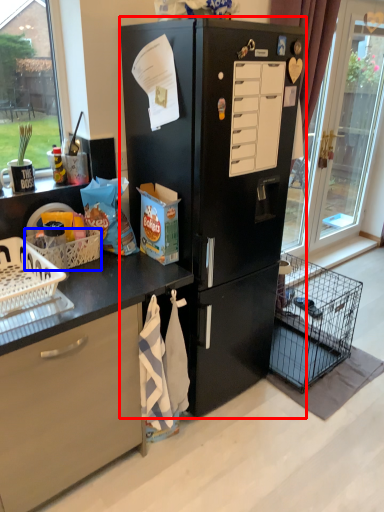
Question: Which of the following is the farthest to the observer, refrigerator (highlighted by a red box) or basket (highlighted by a blue box)?

Choices:
 (A) refrigerator
 (B) basket

Answer: (B)